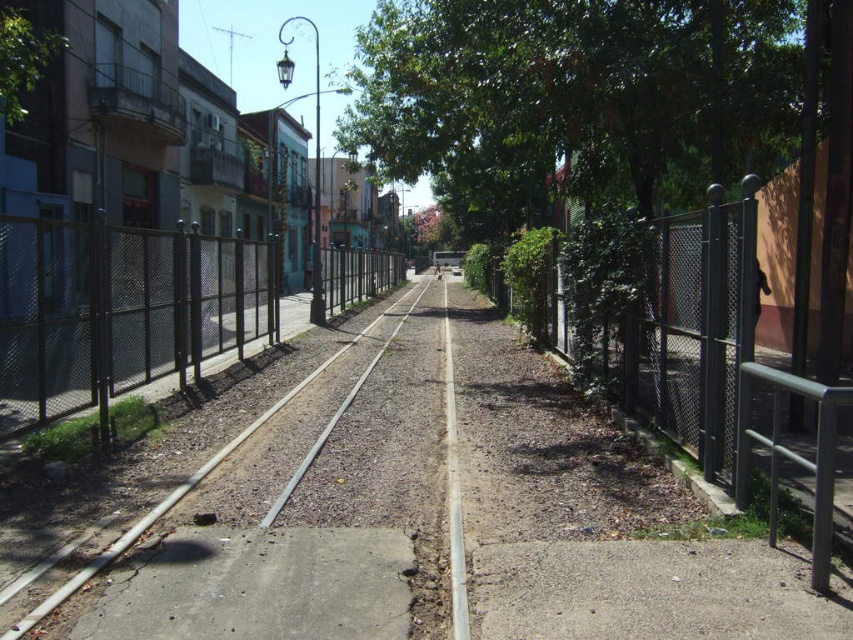
Question: Does gray metallic train track at center appear on the left side of green leafy tree at upper left?

Choices:
 (A) no
 (B) yes

Answer: (A)

Question: Which of the following is the farthest from the observer?

Choices:
 (A) black chain-link fence at left
 (B) gray metallic train track at center

Answer: (A)

Question: Is black chain-link fence at left thinner than green leafy tree at upper left?

Choices:
 (A) yes
 (B) no

Answer: (A)

Question: Considering the relative positions of gray metallic train track at center and green leafy tree at upper left in the image provided, where is gray metallic train track at center located with respect to green leafy tree at upper left?

Choices:
 (A) above
 (B) below

Answer: (B)

Question: Which point is farther to the camera?

Choices:
 (A) (416, 298)
 (B) (42, 300)

Answer: (A)

Question: Based on their relative distances, which object is nearer to the black chain-link fence at left?

Choices:
 (A) gray metallic train track at center
 (B) green leafy tree at upper left

Answer: (A)